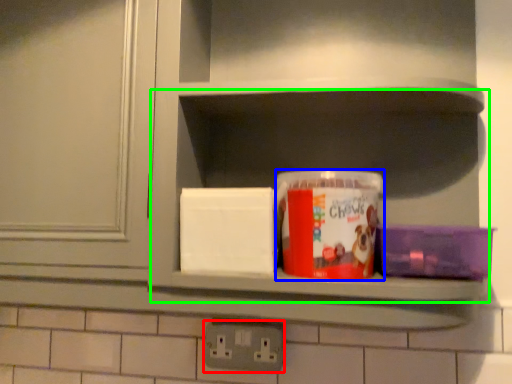
Question: Estimate the real-world distances between objects in this image. Which object is closer to electric outlet (highlighted by a red box), box (highlighted by a blue box) or cabinet (highlighted by a green box)?

Choices:
 (A) box
 (B) cabinet

Answer: (A)